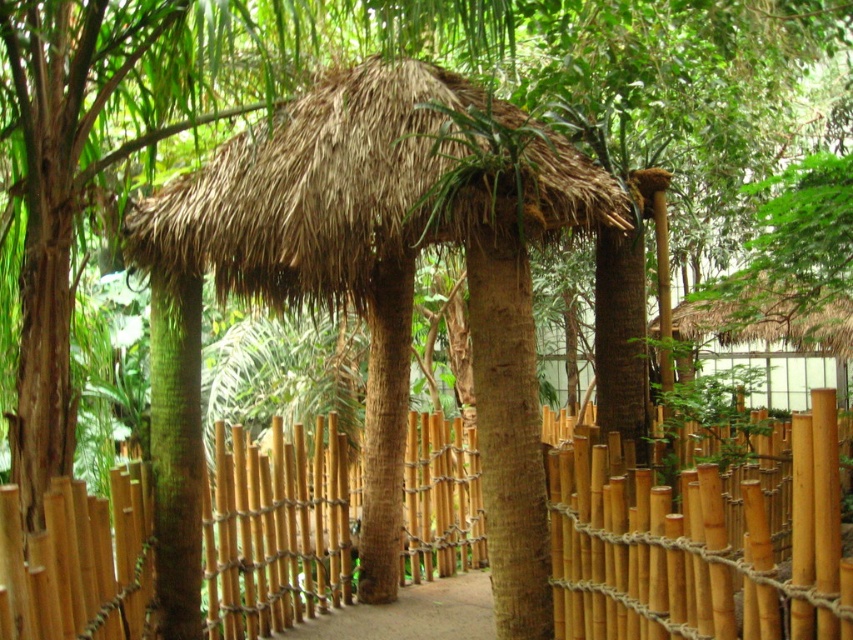
You are standing at the entrance of the traditional hut and want to walk along the brown dirt path at center. Which direction should you turn to face the bamboo fence at center first before proceeding?

The bamboo fence at center is to the left of the brown dirt path at center, so you should turn left to face the bamboo fence at center before walking along the path.

Based on the photo, what are the coordinates of the thatched straw hut at upper right in the image?

The coordinates of the thatched straw hut at upper right are at point (773, 333).

You are standing at the entrance of the traditional hut and want to locate the point marked at coordinates point (700, 540). According to the scene, where exactly would this point be located?

The point (700, 540) is on the bamboo fence at center, so it would be located on the bamboo fence situated at the center of the scene.